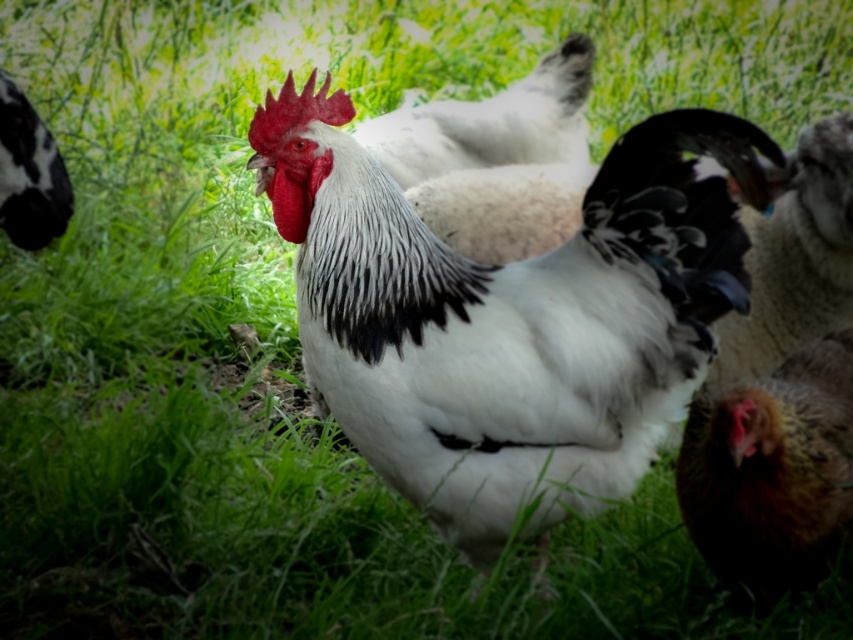
You are holding a camera and want to take a photo of the rooster in the scene. The camera is currently focused on the point at coordinates point (704, 541). If the camera can only focus on objects within 2 meters, will it be able to focus on the rooster?

The distance of point (704, 541) from the camera is 1.99 meters, so yes, the camera can focus on the rooster since it is within the 2 meter range.

Consider the image. You are a farmer who needs to separate the white fluffy rooster at center and the white fluffy chicken at center into different coops. Given that the minimum required space between coops is 5 feet for safety, can you place them in the same coop based on their current distance apart?

The distance between the white fluffy rooster at center and the white fluffy chicken at center is 3.42 feet, which is less than the required 5 feet for safety. Therefore, they cannot be placed in the same coop and must be separated into different coops to meet the safety distance requirement.

You are a birdwatcher who wants to observe the brown speckled feather at lower right from a distance. If you are currently standing 6 feet away from it, will you need to move closer or farther away to get a better view?

The brown speckled feather at lower right is currently 5.53 feet away from the viewer. Since you are standing 6 feet away, you need to move closer by approximately 0.47 feet to reach the current distance.